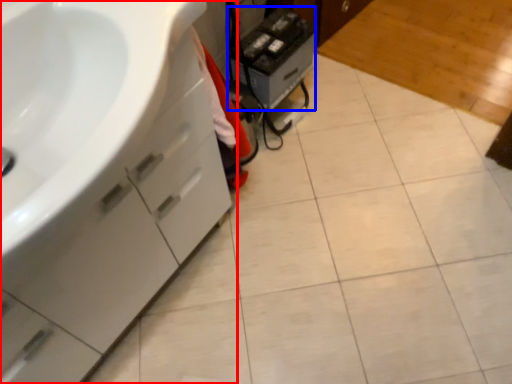
Question: Which object appears closest to the camera in this image, bathroom cabinet (highlighted by a red box) or appliance (highlighted by a blue box)?

Choices:
 (A) bathroom cabinet
 (B) appliance

Answer: (A)